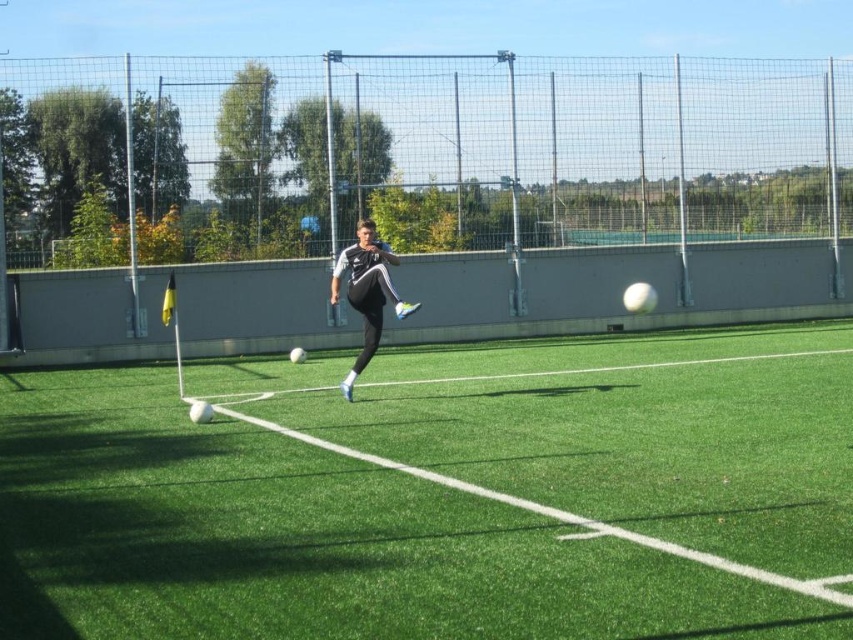
Which of these two, green artificial turf at center or black matte soccer player at center, stands taller?

With more height is black matte soccer player at center.

From the picture: Can you confirm if green artificial turf at center is positioned below black matte soccer player at center?

Indeed, green artificial turf at center is positioned under black matte soccer player at center.

Is point (473, 376) positioned in front of point (374, 241)?

No, (473, 376) is behind (374, 241).

I want to click on green artificial turf at center, so click(x=437, y=492).